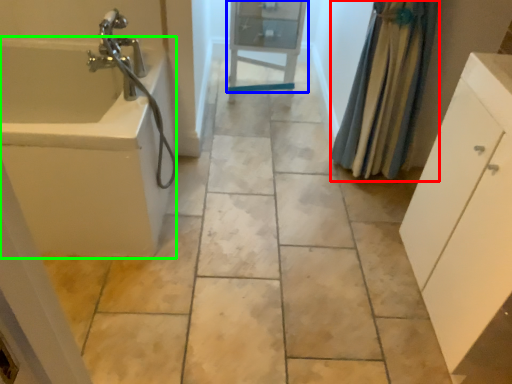
Question: Which is farther away from shower curtain (highlighted by a red box)? cabinetry (highlighted by a blue box) or bath (highlighted by a green box)?

Choices:
 (A) cabinetry
 (B) bath

Answer: (B)